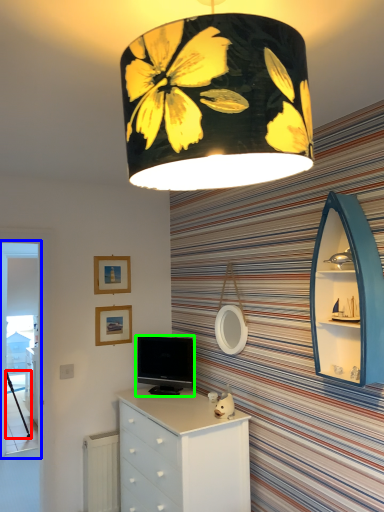
Question: Considering the real-world distances, which object is closest to tripod (highlighted by a red box)? screen door (highlighted by a blue box) or television (highlighted by a green box).

Choices:
 (A) screen door
 (B) television

Answer: (A)